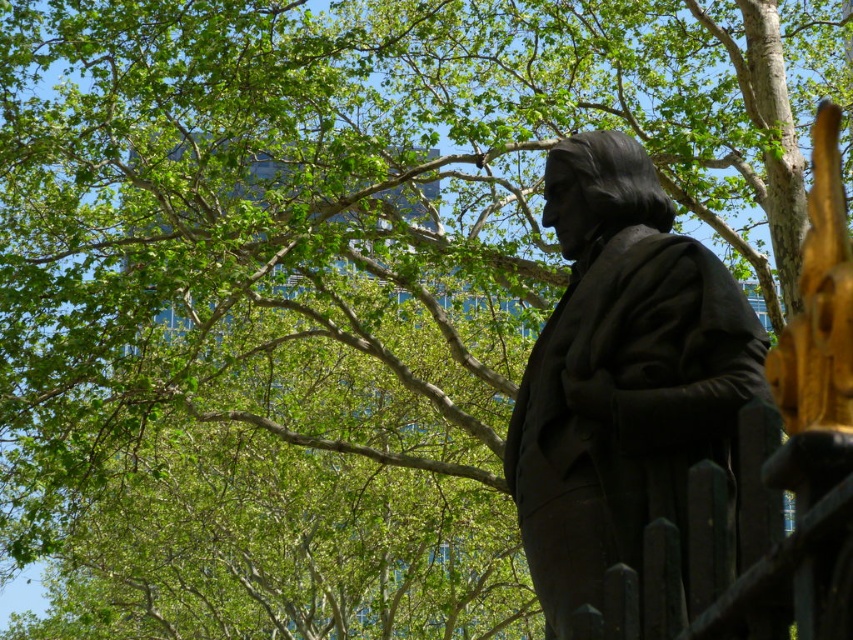
Question: Can you confirm if black polished statue at center is positioned below black metal fence at lower right?

Choices:
 (A) no
 (B) yes

Answer: (A)

Question: Is black polished statue at center smaller than black metal fence at lower right?

Choices:
 (A) yes
 (B) no

Answer: (B)

Question: Can you confirm if black polished statue at center is smaller than black metal fence at lower right?

Choices:
 (A) no
 (B) yes

Answer: (A)

Question: Which point appears closest to the camera in this image?

Choices:
 (A) (587, 632)
 (B) (734, 301)

Answer: (A)

Question: Which point is closer to the camera?

Choices:
 (A) black metal fence at lower right
 (B) black polished statue at center

Answer: (A)